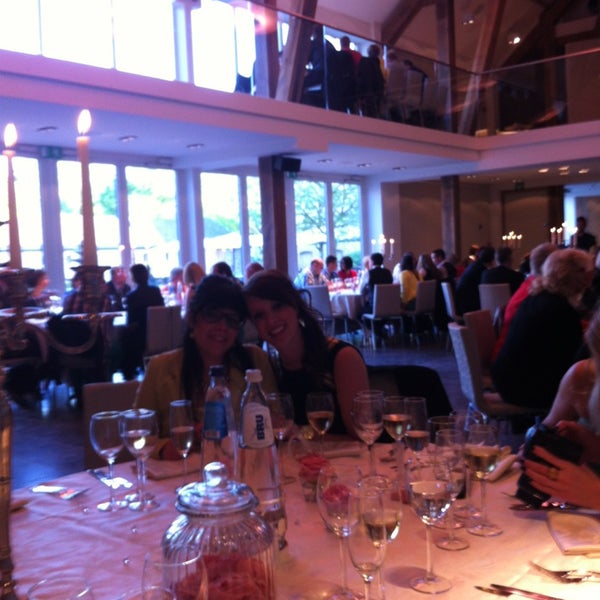
The image size is (600, 600). I want to click on glass container, so click(x=199, y=540).